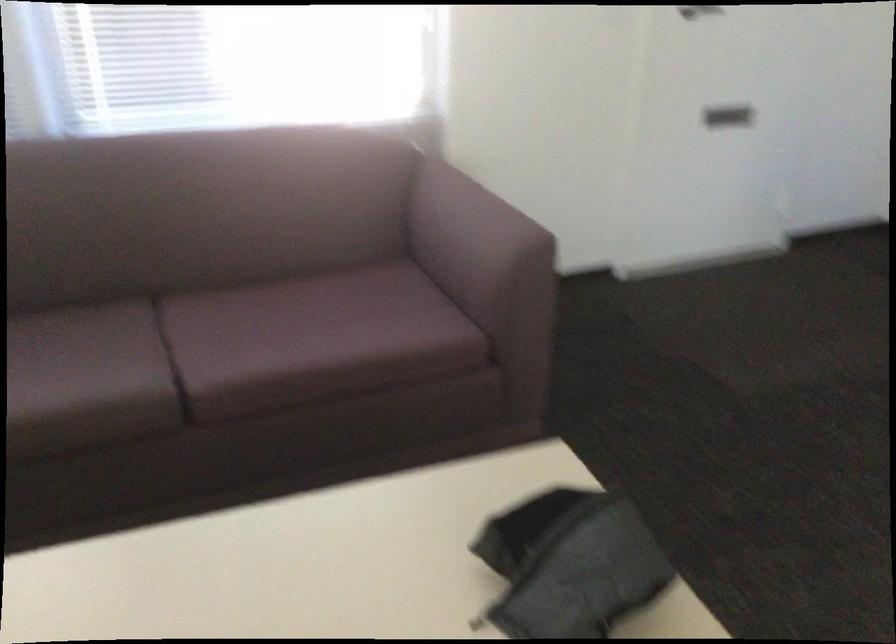
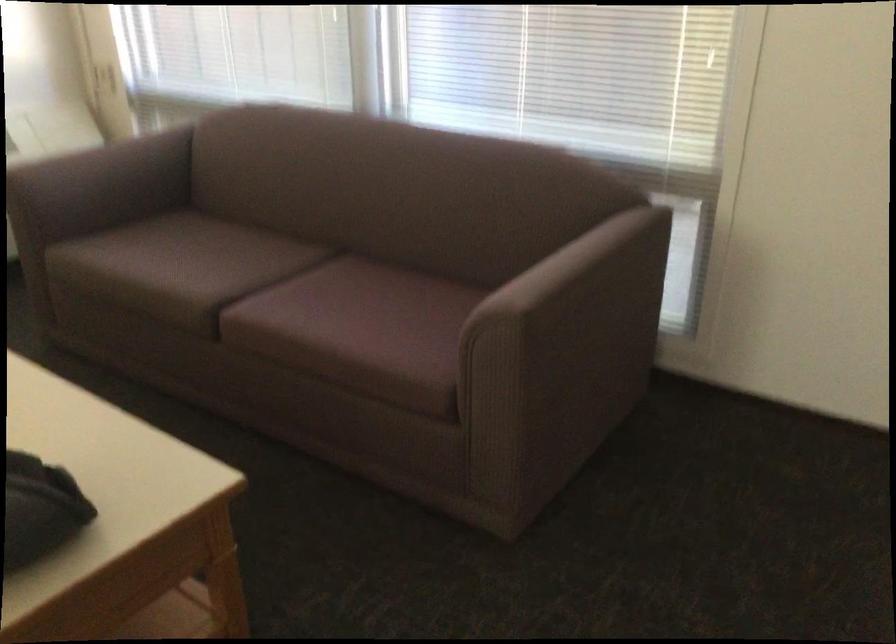
Where in the second image is the point corresponding to pixel 502 204 from the first image?

(579, 265)